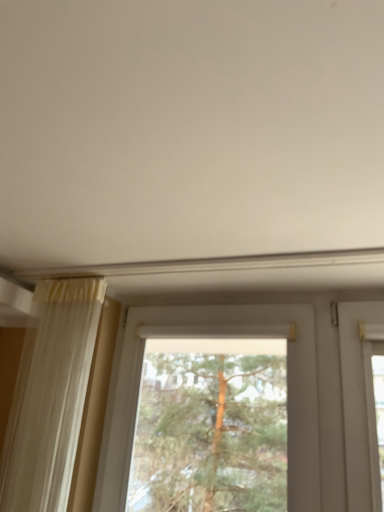
Describe the element at coordinates (50, 396) in the screenshot. The height and width of the screenshot is (512, 384). I see `white sheer curtain at left` at that location.

Find the location of `white sheer curtain at left`. white sheer curtain at left is located at coordinates (50, 396).

The image size is (384, 512). I want to click on white sheer curtain at left, so click(50, 396).